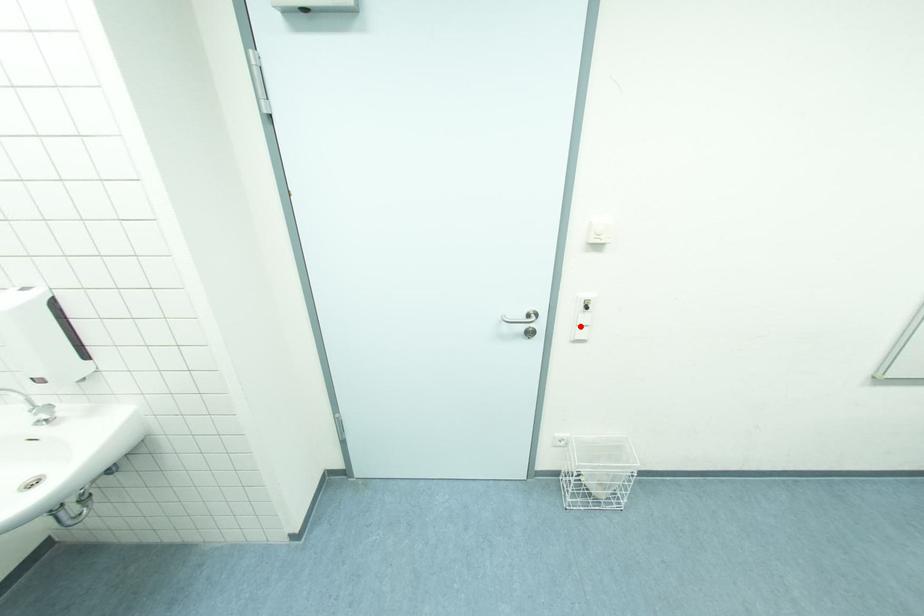
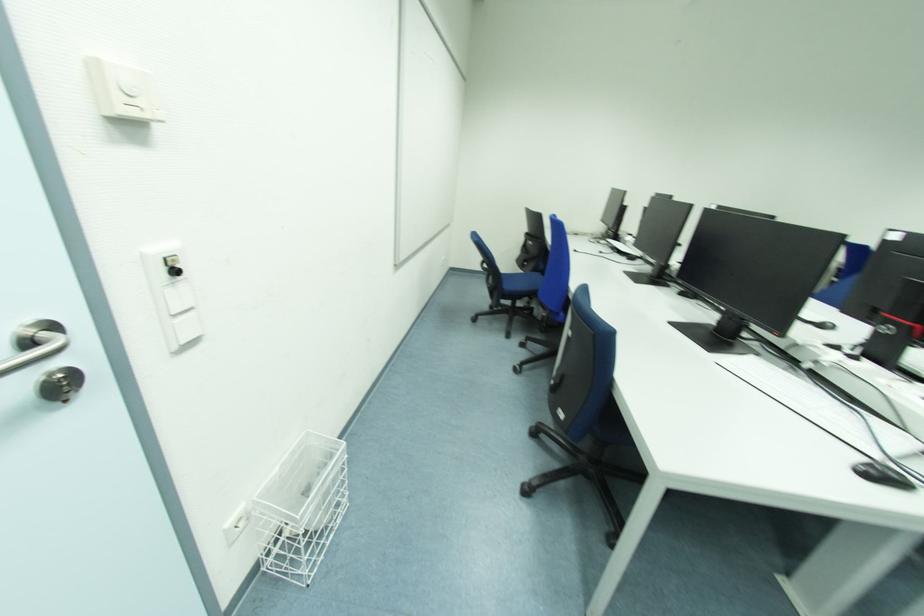
The point at the highlighted location is marked in the first image. Where is the corresponding point in the second image?

(176, 314)